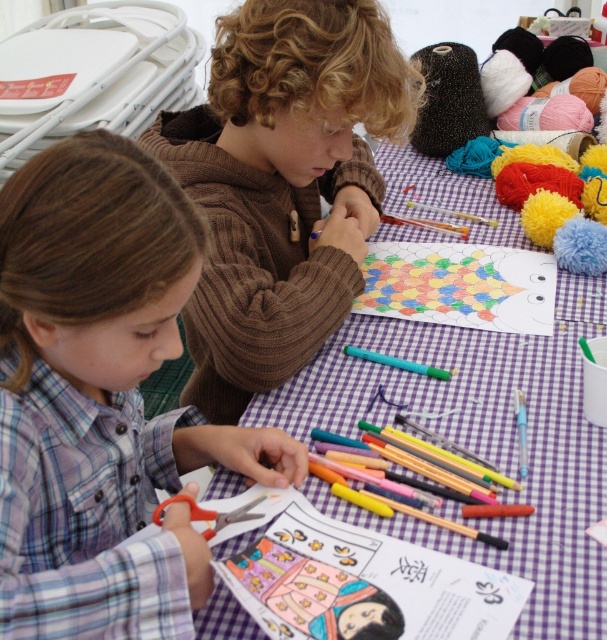
Between plaid fabric shirt at center and brown knitted sweater at upper center, which one has more height?

Standing taller between the two is brown knitted sweater at upper center.

Is point (33, 518) closer to camera compared to point (351, 275)?

Yes, it is in front of point (351, 275).

Identify the location of plaid fabric shirt at center. This screenshot has width=607, height=640. (101, 397).

From the picture: Who is shorter, plaid fabric shirt at center or purple checkered table at center?

Standing shorter between the two is plaid fabric shirt at center.

Who is more forward, (185,266) or (476,403)?

Point (185,266) is in front.

In order to click on plaid fabric shirt at center in this screenshot , I will do `click(101, 397)`.

Between purple checkered table at center and orange plastic scissors at lower left, which one has more height?

purple checkered table at center

Between purple checkered table at center and orange plastic scissors at lower left, which one has less height?

With less height is orange plastic scissors at lower left.

The height and width of the screenshot is (640, 607). What do you see at coordinates (483, 440) in the screenshot?
I see `purple checkered table at center` at bounding box center [483, 440].

Find the location of a particular element. This screenshot has width=607, height=640. purple checkered table at center is located at coordinates (483, 440).